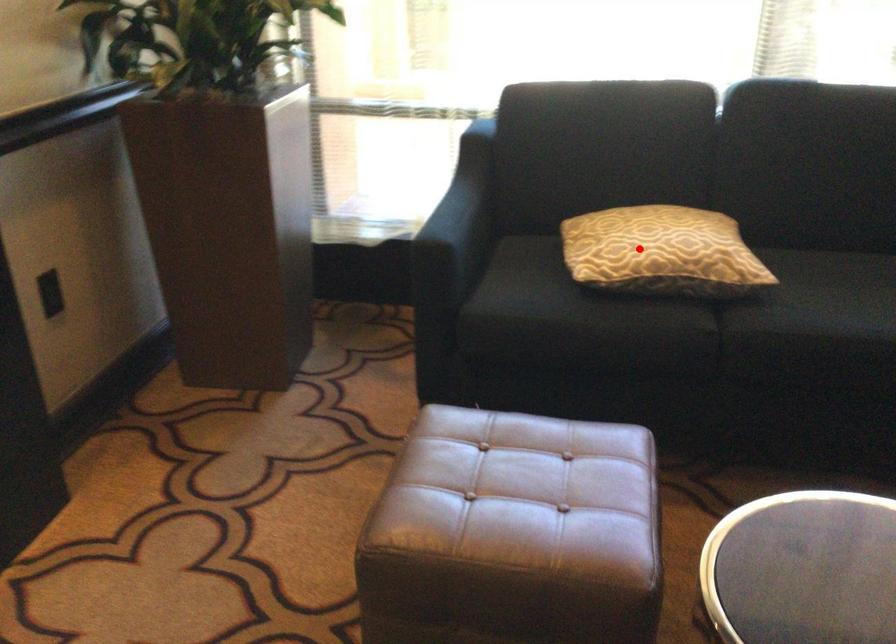
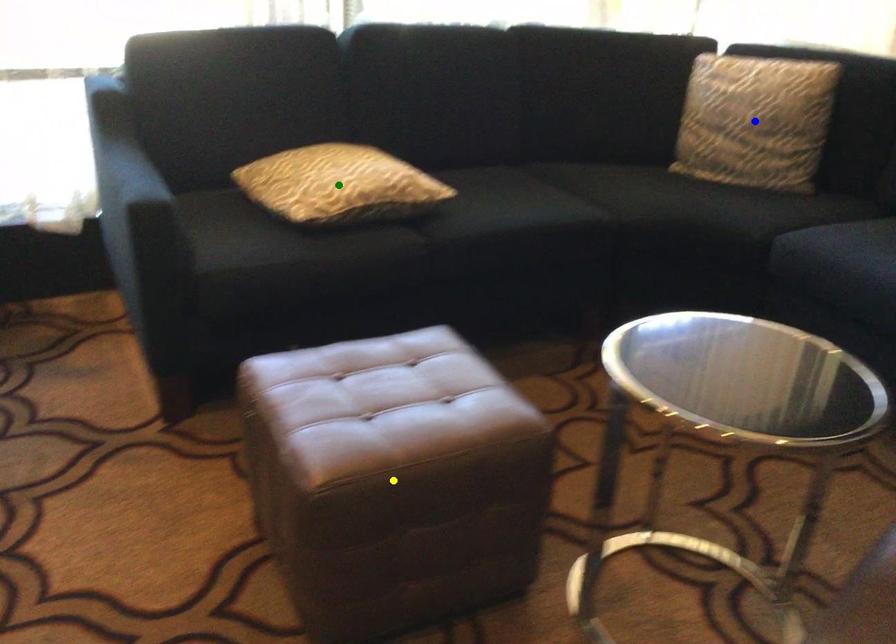
Question: I am providing you with two images of the same scene from different viewpoints. A red point is marked on the first image. You are given multiple points on the second image. Can you choose the point in image 2 that corresponds to the point in image 1?

Choices:
 (A) blue point
 (B) yellow point
 (C) green point

Answer: (C)